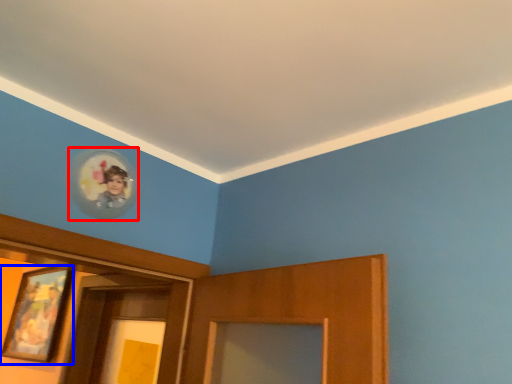
Question: Among these objects, which one is farthest to the camera, picture frame (highlighted by a red box) or picture frame (highlighted by a blue box)?

Choices:
 (A) picture frame
 (B) picture frame

Answer: (B)